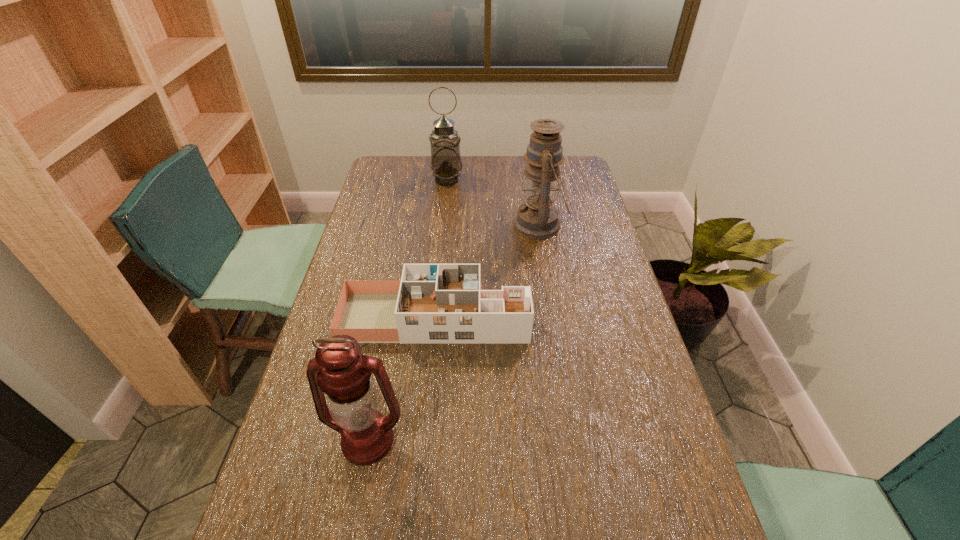
Find the location of a particular element. This screenshot has width=960, height=540. object that is at the far edge is located at coordinates (446, 165).

The height and width of the screenshot is (540, 960). I want to click on oil lamp at the left edge, so click(338, 369).

Locate an element on the screen. This screenshot has height=540, width=960. dollhouse located in the left edge section of the desktop is located at coordinates (436, 303).

Locate an element on the screen. object positioned at the right edge is located at coordinates (538, 218).

You are a GUI agent. You are given a task and a screenshot of the screen. Output one action in this format:
    pyautogui.click(x=<x>, y=<y>)
    Task: Click on the vacant space at the far edge of the desktop
    The image size is (960, 540).
    Given the screenshot: What is the action you would take?
    pyautogui.click(x=414, y=184)

This screenshot has height=540, width=960. In order to click on vacant point at the left edge in this screenshot , I will do `click(308, 416)`.

Find the location of a particular element. Image resolution: width=960 pixels, height=540 pixels. vacant space at the right edge is located at coordinates (635, 502).

The width and height of the screenshot is (960, 540). Identify the location of vacant region between the nearest object and the shortest object. (401, 379).

In order to click on empty space that is in between the farthest object and the rightmost oil lamp in this screenshot , I will do point(493,202).

Find the location of a particular element. The image size is (960, 540). free spot between the second farthest object and the farthest oil lamp is located at coordinates (493, 202).